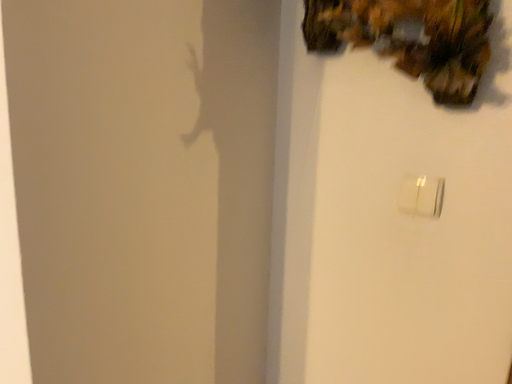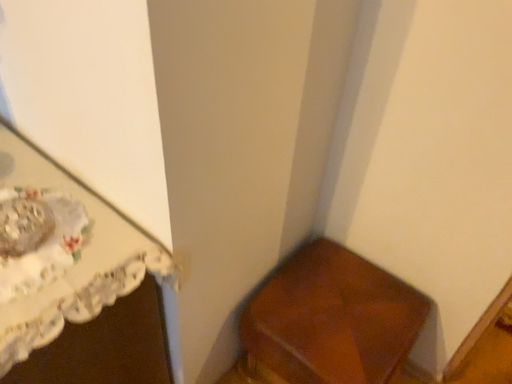
Question: How did the camera likely rotate when shooting the video?

Choices:
 (A) rotated upward
 (B) rotated downward

Answer: (B)